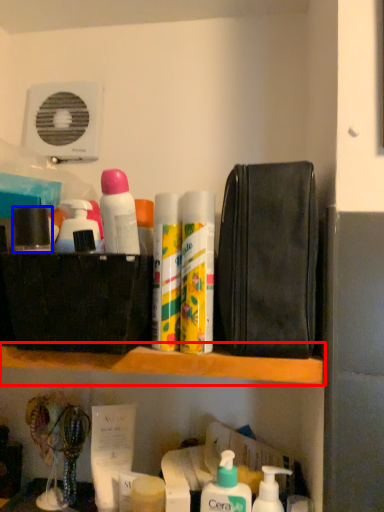
Question: Which point is further to the camera, shelf (highlighted by a red box) or toiletry (highlighted by a blue box)?

Choices:
 (A) shelf
 (B) toiletry

Answer: (B)